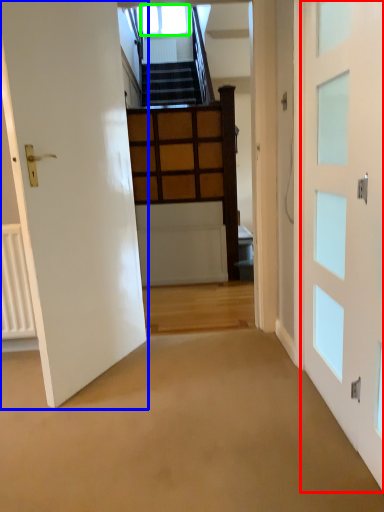
Question: Which object is positioned farthest from door (highlighted by a red box)? Select from door (highlighted by a blue box) and window (highlighted by a green box).

Choices:
 (A) door
 (B) window

Answer: (B)